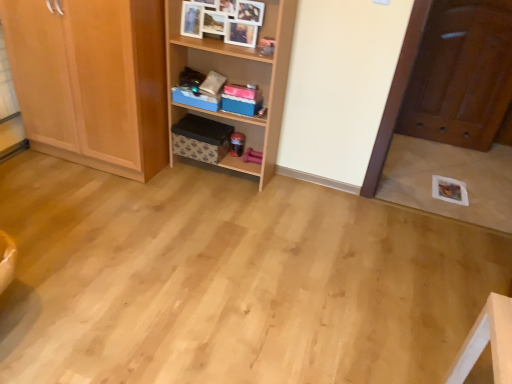
What are the coordinates of `brown cardboard box at center` in the screenshot? It's located at (201, 139).

What do you see at coordinates (92, 81) in the screenshot? I see `light wood cabinet at left` at bounding box center [92, 81].

Identify the location of wooden shelf at center. (239, 78).

Image resolution: width=512 pixels, height=384 pixels. Describe the element at coordinates (239, 78) in the screenshot. I see `wooden shelf at center` at that location.

The height and width of the screenshot is (384, 512). What do you see at coordinates (195, 99) in the screenshot?
I see `blue fabric storage box at center` at bounding box center [195, 99].

Locate an element on the screen. The image size is (512, 384). blue fabric storage box at center is located at coordinates (195, 99).

Where is `brown cardboard box at center`? The height and width of the screenshot is (384, 512). brown cardboard box at center is located at coordinates (201, 139).

Does blue fabric storage box at center turn towards wooden shelf at center?

Yes, blue fabric storage box at center is oriented towards wooden shelf at center.

Is blue fabric storage box at center to the left of wooden shelf at center from the viewer's perspective?

Yes.

I want to click on storage box directly beneath the wooden shelf at center (from a real-world perspective), so click(x=195, y=99).

Where is `storage box located behind the wooden shelf at center`? The height and width of the screenshot is (384, 512). storage box located behind the wooden shelf at center is located at coordinates 195,99.

Looking at this image, considering the relative positions of wooden shelf at center and blue fabric storage box at center in the image provided, is wooden shelf at center to the left or to the right of blue fabric storage box at center?

From the image, it's evident that wooden shelf at center is to the right of blue fabric storage box at center.

Can you confirm if wooden shelf at center is bigger than blue fabric storage box at center?

Indeed, wooden shelf at center has a larger size compared to blue fabric storage box at center.

Can you confirm if blue fabric storage box at center is shorter than brown cardboard box at center?

Correct, blue fabric storage box at center is not as tall as brown cardboard box at center.

Is blue fabric storage box at center surrounding brown cardboard box at center?

No, brown cardboard box at center is located outside of blue fabric storage box at center.

What's the angular difference between blue fabric storage box at center and brown cardboard box at center's facing directions?

7.51e-05 degrees separate the facing orientations of blue fabric storage box at center and brown cardboard box at center.

Based on the photo, can you confirm if wooden cabinet at upper center is thinner than wooden shelf at center?

Yes, wooden cabinet at upper center is thinner than wooden shelf at center.

Considering the positions of points (195, 47) and (265, 64), is point (195, 47) closer to camera compared to point (265, 64)?

Yes.

From the image's perspective, between wooden cabinet at upper center and wooden shelf at center, who is located below?

From the image's view, wooden shelf at center is below.

Is wooden cabinet at upper center oriented away from wooden shelf at center?

Yes, wooden cabinet at upper center is positioned with its back facing wooden shelf at center.

Is shiny brown door at right with light wood cabinet at left?

They are not placed beside each other.

Locate an element on the screen. This screenshot has height=384, width=512. door on the right of light wood cabinet at left is located at coordinates (461, 75).

From a real-world perspective, is shiny brown door at right physically below light wood cabinet at left?

No, from a real-world perspective, shiny brown door at right is not below light wood cabinet at left.

Which is closer to the camera, [467,36] or [75,65]?

Point [467,36] is positioned farther from the camera compared to point [75,65].

From a real-world perspective, is wooden cabinet at upper center located beneath light wood cabinet at left?

No, from a real-world perspective, wooden cabinet at upper center is not below light wood cabinet at left.

Is wooden cabinet at upper center oriented towards light wood cabinet at left?

No, wooden cabinet at upper center is not facing towards light wood cabinet at left.

Which of these two, wooden cabinet at upper center or light wood cabinet at left, stands shorter?

With less height is wooden cabinet at upper center.

Considering their positions, is wooden cabinet at upper center located in front of or behind light wood cabinet at left?

Visually, wooden cabinet at upper center is located behind light wood cabinet at left.

Who is bigger, shiny brown door at right or brown cardboard box at center?

Bigger between the two is shiny brown door at right.

Based on their positions, is shiny brown door at right located to the left or right of brown cardboard box at center?

From the image, it's evident that shiny brown door at right is to the right of brown cardboard box at center.

Which object is further away from the camera, shiny brown door at right or brown cardboard box at center?

Positioned behind is shiny brown door at right.

How far apart are shiny brown door at right and brown cardboard box at center?

shiny brown door at right and brown cardboard box at center are 5.50 feet apart.

You are a GUI agent. You are given a task and a screenshot of the screen. Output one action in this format:
    pyautogui.click(x=<x>, y=<y>)
    Task: Click on the shelf that appears above the blue fabric storage box at center (from the image's perspective)
    The width and height of the screenshot is (512, 384).
    Given the screenshot: What is the action you would take?
    pyautogui.click(x=239, y=78)

Identify the location of storage box behind the wooden shelf at center. This screenshot has width=512, height=384. (195, 99).

Estimate the real-world distances between objects in this image. Which object is further from wooden shelf at center, blue fabric storage box at center or brown cardboard box at center?

Based on the image, brown cardboard box at center appears to be further to wooden shelf at center.

Which object lies further to the anchor point brown cardboard box at center, wooden cabinet at upper center or shiny brown door at right?

shiny brown door at right lies further to brown cardboard box at center than the other object.

When comparing their distances from brown cardboard box at center, does light wood cabinet at left or wooden shelf at center seem further?

Among the two, light wood cabinet at left is located further to brown cardboard box at center.

In the scene shown: Estimate the real-world distances between objects in this image. Which object is further from light wood cabinet at left, brown cardboard box at center or wooden shelf at center?

brown cardboard box at center is positioned further to the anchor light wood cabinet at left.

When comparing their distances from light wood cabinet at left, does wooden cabinet at upper center or wooden shelf at center seem further?

Based on the image, wooden cabinet at upper center appears to be further to light wood cabinet at left.

Estimate the real-world distances between objects in this image. Which object is further from shiny brown door at right, brown cardboard box at center or light wood cabinet at left?

Based on the image, light wood cabinet at left appears to be further to shiny brown door at right.

Considering their positions, is wooden shelf at center positioned closer to brown cardboard box at center than blue fabric storage box at center?

Among the two, blue fabric storage box at center is located nearer to brown cardboard box at center.

Considering their positions, is blue fabric storage box at center positioned further to wooden cabinet at upper center than shiny brown door at right?

shiny brown door at right.

What are the coordinates of `storage box between light wood cabinet at left and wooden cabinet at upper center in the horizontal direction` in the screenshot? It's located at (195, 99).

Locate an element on the screen. shelf between brown cardboard box at center and shiny brown door at right in the horizontal direction is located at coordinates (239, 78).

Locate an element on the screen. cardboard box situated between light wood cabinet at left and wooden shelf at center from left to right is located at coordinates (201, 139).

Identify the location of shelf between wooden cabinet at upper center and blue fabric storage box at center in the up-down direction. (239, 78).